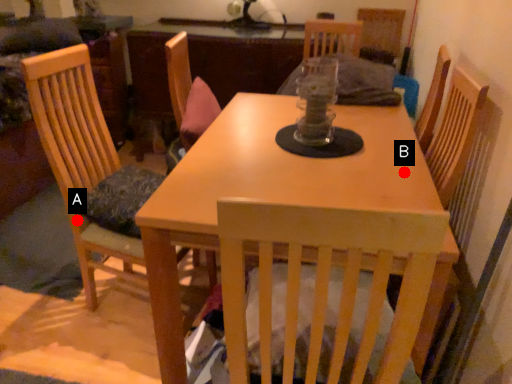
Question: Two points are circled on the image, labeled by A and B beside each circle. Among these points, which one is farthest from the camera?

Choices:
 (A) A is further
 (B) B is further

Answer: (A)